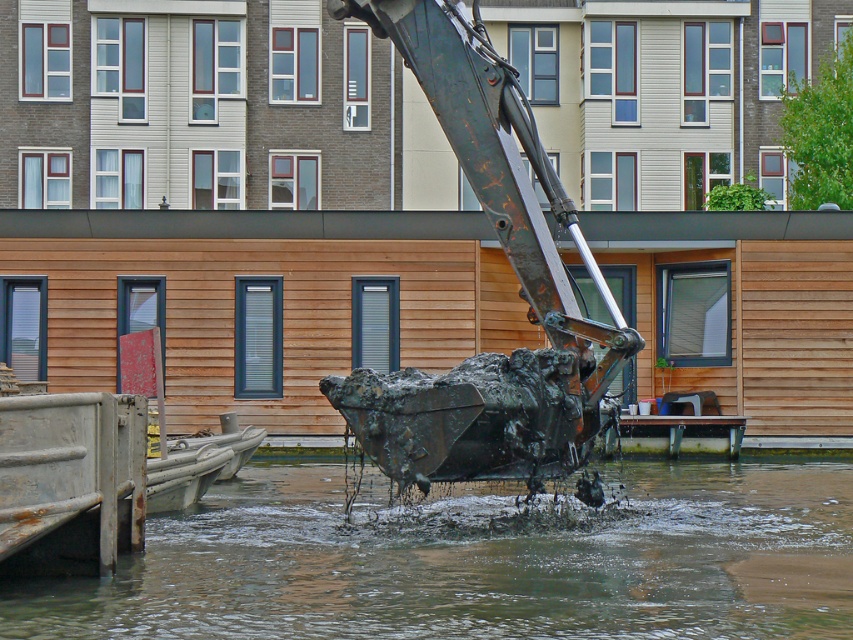
You are standing at the point marked by the coordinates point (x=477, y=561) in the image. What is the immediate surface you are standing on?

The point (x=477, y=561) indicates translucent water at center, so you are standing on water.

You are a crane operator trying to lift a heavy object from the water. You notice the rusty metal excavator at center and the smooth wooden dock at center. Which object is taller and would block your crane arm if you try to lift something from the water?

The rusty metal excavator at center is much taller than the smooth wooden dock at center, so it would block the crane arm if you try to lift something from the water.